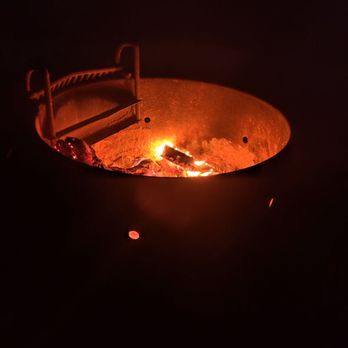
This screenshot has width=348, height=348. Identify the location of ventilation hole. (135, 235).